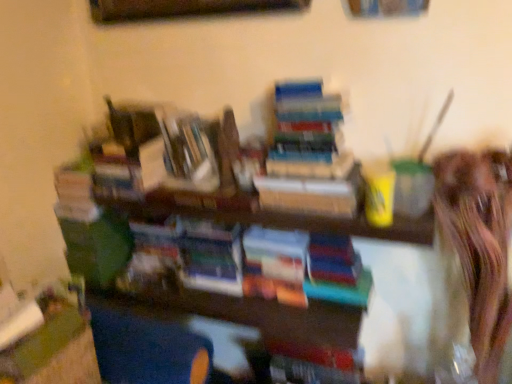
Question: Is hardcover books at center, positioned as the fourth book in left-to-right order, further to camera compared to hardcover book at center, acting as the 4th book starting from the right?

Choices:
 (A) yes
 (B) no

Answer: (B)

Question: Is hardcover books at center, the first book when ordered from right to left, wider than hardcover book at center, acting as the 4th book starting from the right?

Choices:
 (A) yes
 (B) no

Answer: (A)

Question: Is hardcover book at center, arranged as the first book when viewed from the left, at the back of hardcover books at center, the first book when ordered from right to left?

Choices:
 (A) no
 (B) yes

Answer: (A)

Question: Is hardcover books at center, the first book when ordered from right to left, smaller than hardcover book at center, arranged as the first book when viewed from the left?

Choices:
 (A) yes
 (B) no

Answer: (B)

Question: Considering the relative sizes of hardcover books at center, positioned as the fourth book in left-to-right order, and hardcover book at center, acting as the 4th book starting from the right, in the image provided, is hardcover books at center, positioned as the fourth book in left-to-right order, taller than hardcover book at center, acting as the 4th book starting from the right,?

Choices:
 (A) no
 (B) yes

Answer: (B)

Question: Is hardcover book at center, arranged as the first book when viewed from the left, spatially inside shiny brown hair at right, or outside of it?

Choices:
 (A) inside
 (B) outside

Answer: (B)

Question: From a real-world perspective, relative to shiny brown hair at right, is hardcover book at center, acting as the 4th book starting from the right, vertically above or below?

Choices:
 (A) below
 (B) above

Answer: (B)

Question: Based on their sizes in the image, would you say hardcover book at center, acting as the 4th book starting from the right, is bigger or smaller than shiny brown hair at right?

Choices:
 (A) big
 (B) small

Answer: (B)

Question: Is point coord(66,183) closer or farther from the camera than point coord(471,173)?

Choices:
 (A) farther
 (B) closer

Answer: (A)

Question: Visually, is hardcover book at center, the third book viewed from the right, positioned to the left or to the right of multicolored paper book at center, the second book positioned from the right?

Choices:
 (A) left
 (B) right

Answer: (A)

Question: Is hardcover book at center, the third book viewed from the right, inside or outside of multicolored paper book at center, the second book positioned from the right?

Choices:
 (A) outside
 (B) inside

Answer: (A)

Question: Looking at their shapes, would you say hardcover book at center, the third book viewed from the right, is wider or thinner than multicolored paper book at center, the second book positioned from the right?

Choices:
 (A) wide
 (B) thin

Answer: (B)

Question: From the image's perspective, is hardcover book at center, the third book viewed from the right, positioned above or below multicolored paper book at center, which is the third book from left to right?

Choices:
 (A) below
 (B) above

Answer: (B)

Question: From the image's perspective, relative to hardcover book at center, positioned as the second book in left-to-right order, is hardcover books at center, positioned as the fourth book in left-to-right order, above or below?

Choices:
 (A) above
 (B) below

Answer: (A)

Question: In terms of width, does hardcover books at center, positioned as the fourth book in left-to-right order, look wider or thinner when compared to hardcover book at center, positioned as the second book in left-to-right order?

Choices:
 (A) thin
 (B) wide

Answer: (B)